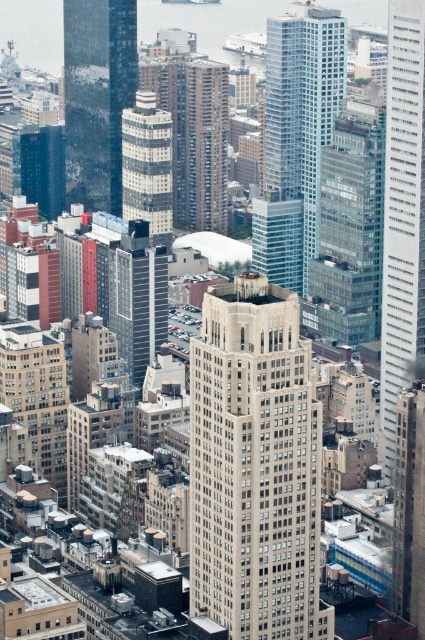
Can you confirm if reflective glass skyscraper at center-left is thinner than glassy steel skyscraper at center?

Incorrect, reflective glass skyscraper at center-left's width is not less than glassy steel skyscraper at center's.

Which is behind, point (105, 172) or point (152, 253)?

The point (105, 172) is behind.

Locate an element on the screen. This screenshot has height=640, width=425. reflective glass skyscraper at center-left is located at coordinates pos(98,97).

Who is lower down, reflective glass skyscraper at center-left or metallic glass tower at center?

metallic glass tower at center is lower down.

Who is positioned more to the left, reflective glass skyscraper at center-left or metallic glass tower at center?

Positioned to the left is reflective glass skyscraper at center-left.

Which is in front, point (98, 29) or point (164, 116)?

Point (164, 116) is more forward.

Find the location of a particular element. This screenshot has width=425, height=640. reflective glass skyscraper at center-left is located at coordinates (98, 97).

What do you see at coordinates (402, 211) in the screenshot?
I see `smooth glass skyscraper at right` at bounding box center [402, 211].

Which is below, smooth glass skyscraper at right or metallic glass tower at center?

Positioned lower is smooth glass skyscraper at right.

The image size is (425, 640). In order to click on smooth glass skyscraper at right in this screenshot , I will do `click(402, 211)`.

Where is `smooth glass skyscraper at right`? The image size is (425, 640). smooth glass skyscraper at right is located at coordinates click(402, 211).